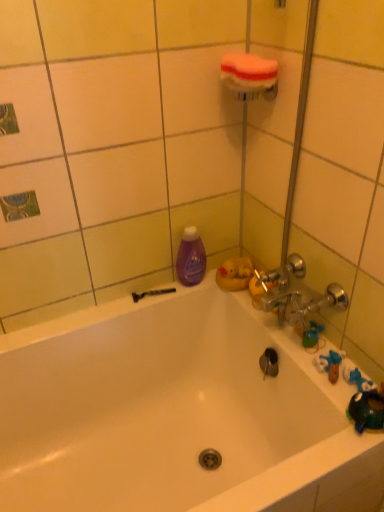
The image size is (384, 512). I want to click on vacant space situated on the left part of purple glossy bottle at upper left, so click(149, 297).